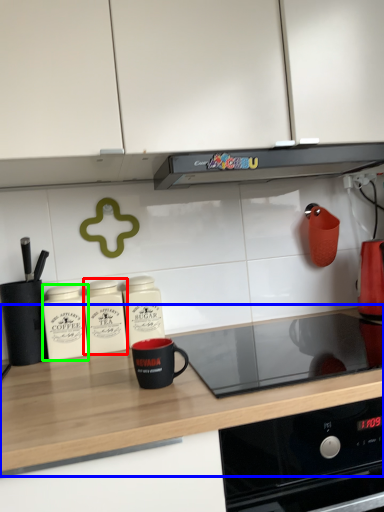
Question: Which object is the closest to the kitchen appliance (highlighted by a red box)? Choose among these: countertop (highlighted by a blue box) or kitchen appliance (highlighted by a green box).

Choices:
 (A) countertop
 (B) kitchen appliance

Answer: (B)